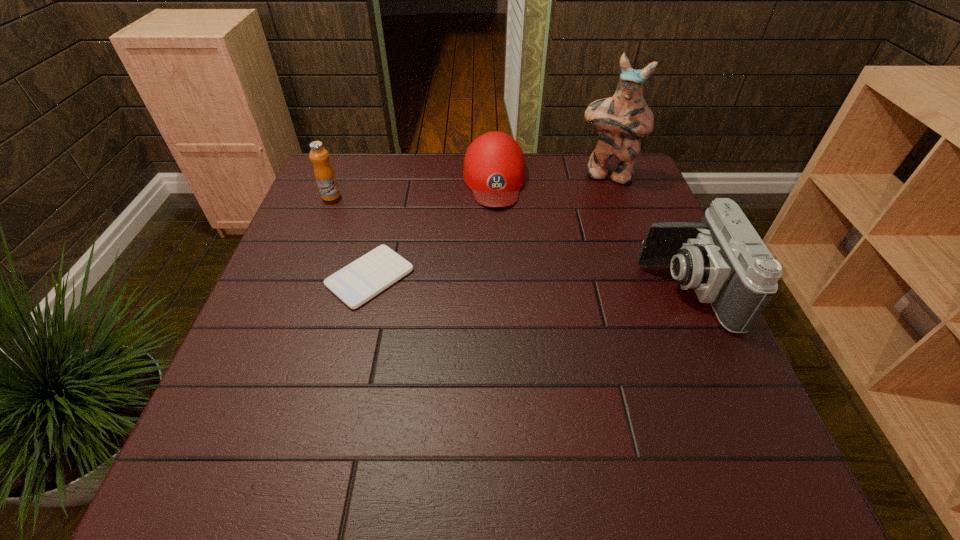
You are a GUI agent. You are given a task and a screenshot of the screen. Output one action in this format:
    pyautogui.click(x=<x>, y=<y>)
    Task: Click on the vacant space located at the front of the camera with an open lens cover
    
    Given the screenshot: What is the action you would take?
    pyautogui.click(x=491, y=289)

The image size is (960, 540). Identify the location of vacant space located 0.160m on the front label of the leftmost object. (378, 219).

This screenshot has width=960, height=540. Find the location of `free region located on the front label of the leftmost object`. free region located on the front label of the leftmost object is located at coordinates [x=349, y=205].

Where is `vacant area situated on the front label of the leftmost object`? The width and height of the screenshot is (960, 540). vacant area situated on the front label of the leftmost object is located at coordinates (441, 249).

The width and height of the screenshot is (960, 540). What are the coordinates of `blank area located on the front-facing side of the second shortest object` in the screenshot? It's located at (503, 270).

In order to click on vacant space located 0.180m on the front-facing side of the second shortest object in this screenshot , I will do `click(501, 256)`.

You are a GUI agent. You are given a task and a screenshot of the screen. Output one action in this format:
    pyautogui.click(x=<x>, y=<y>)
    Task: Click on the vacant area situated on the front-facing side of the second shortest object
    
    Given the screenshot: What is the action you would take?
    pyautogui.click(x=500, y=240)

The height and width of the screenshot is (540, 960). What are the coordinates of `blank space located 0.370m on the front-facing side of the figurine` in the screenshot? It's located at (570, 270).

I want to click on free space located 0.190m on the front-facing side of the figurine, so click(x=586, y=225).

At what (x,y) coordinates should I click in order to perform the action: click on blank space located 0.290m on the front-facing side of the figurine. Please return your answer as a coordinate pair (x, y). Looking at the image, I should click on (578, 249).